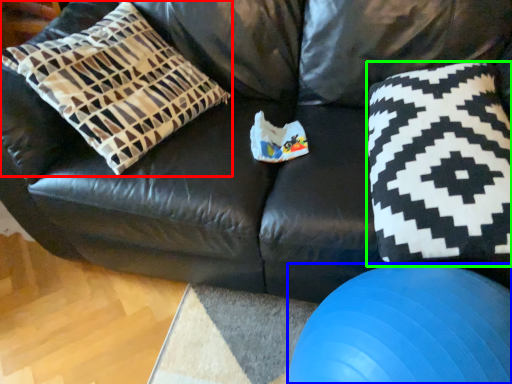
Question: Estimate the real-world distances between objects in this image. Which object is farther from pillow (highlighted by a red box), ball (highlighted by a blue box) or throw pillow (highlighted by a green box)?

Choices:
 (A) ball
 (B) throw pillow

Answer: (A)